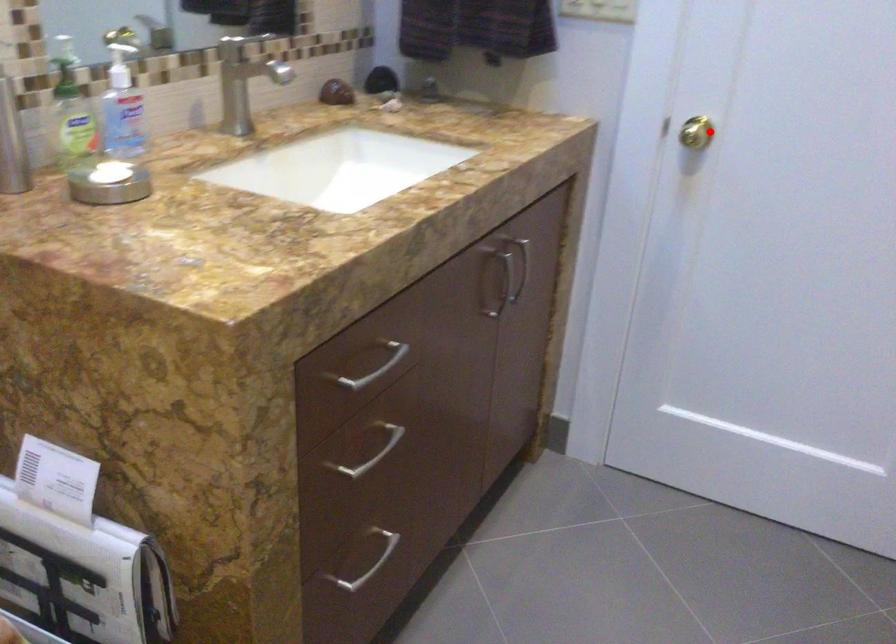
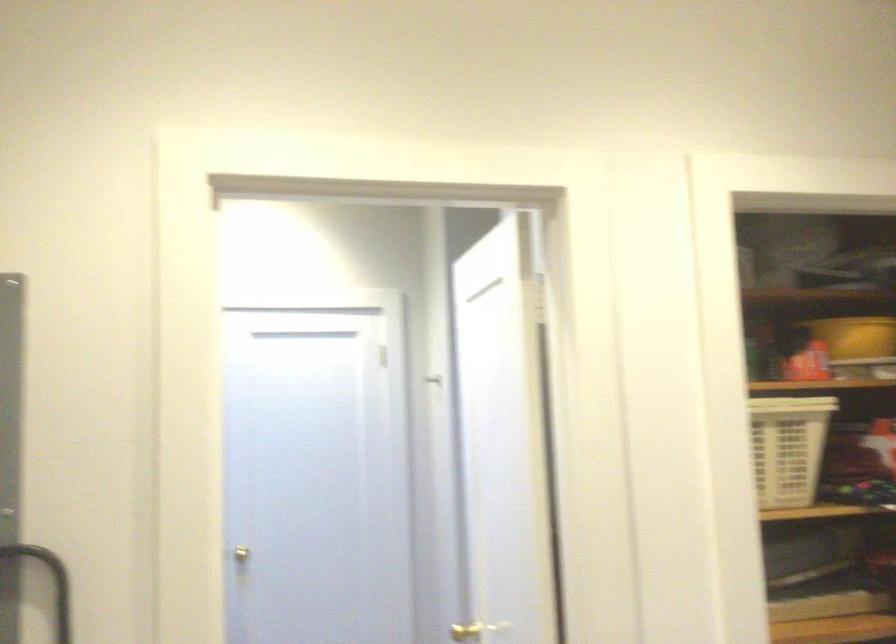
Question: I am providing you with two images of the same scene from different viewpoints. A red point is marked on the first image. At the location where the point appears in image 1, is it still visible in image 2?

Choices:
 (A) Yes
 (B) No

Answer: (A)